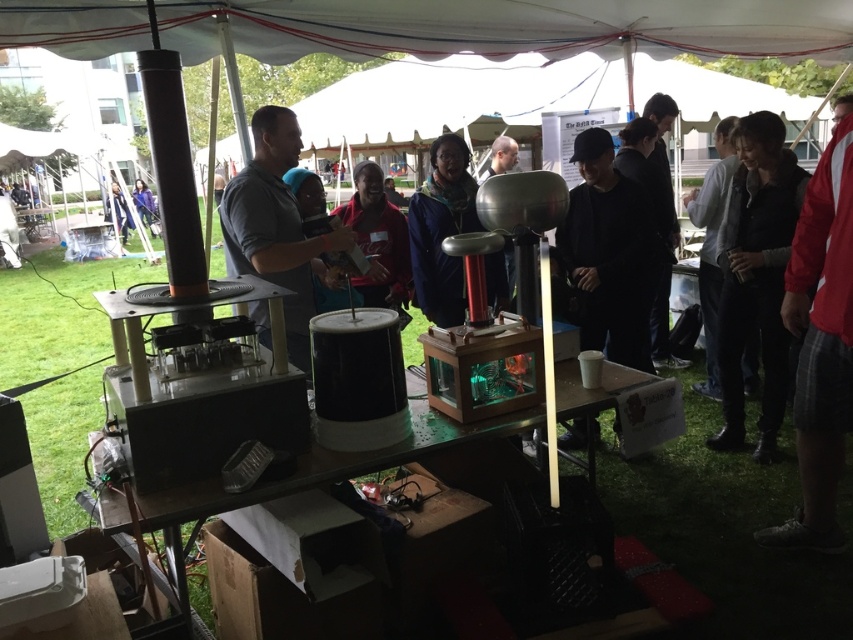
From the picture: You are standing at the origin point of the coordinate system in the image. Which direction should you move to reach the red plaid shorts at right?

The red plaid shorts at right is located at coordinate point 0.541 on the x axis and 0.962 on the y axis. Since you are at the origin, you should move right along the x axis to 0.541 and up along the y axis to 0.962 to reach it.

You are organizing a science fair and need to arrange participants based on their clothing. If you have to place the matte black shirt at center and the blue fabric jacket at upper left in order of size from smallest to largest, which should come first?

The matte black shirt at center occupies less space than the blue fabric jacket at upper left, so it should come first in the order from smallest to largest.